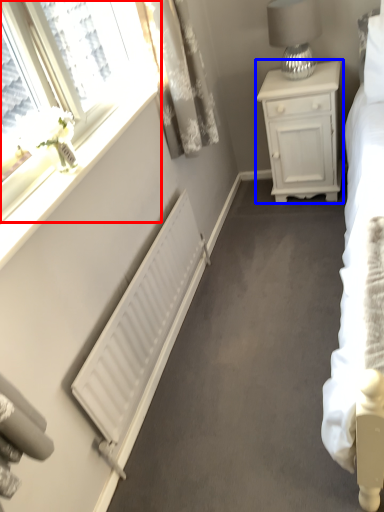
Question: Which object is closer to the camera taking this photo, window (highlighted by a red box) or nightstand (highlighted by a blue box)?

Choices:
 (A) window
 (B) nightstand

Answer: (A)